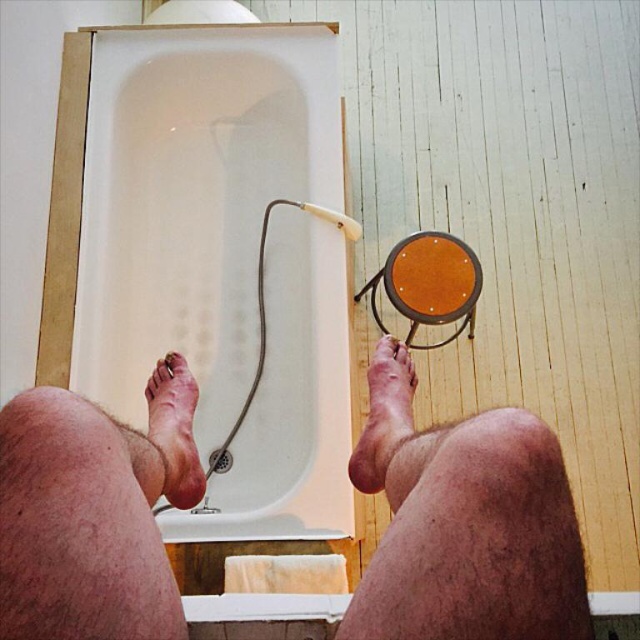
What are the coordinates of the white glossy bathtub at lower left?

The white glossy bathtub at lower left is located at coordinates point (193, 198).

You are standing in the bathroom and want to step onto the stool to reach the showerhead. Your dry skin foot at lower left and dry skin foot at lower center are both on the floor. Which foot should you lift first to avoid slipping?

You should lift the dry skin foot at lower left first because it is in front of the dry skin foot at lower center, so lifting it first will allow you to shift your weight and avoid slipping.

You are a caregiver assisting someone who needs to get into the bathtub. The person has limited mobility and requires support. Considering the white glossy bathtub at lower left and the dry skin foot at lower left, which object is more suitable to use as a support to help them safely enter the bathtub?

The white glossy bathtub at lower left is larger in size than the dry skin foot at lower left, so the white glossy bathtub at lower left would be more suitable as a support surface due to its larger size providing better stability.